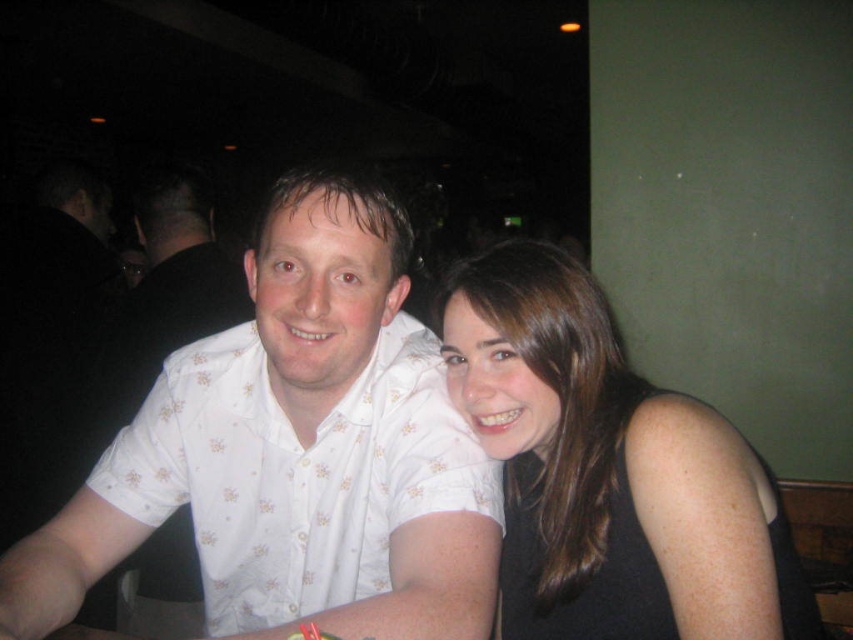
Between white floral shirt at center and white floral shirt at left, which one has less height?

white floral shirt at center

Describe the element at coordinates (294, 452) in the screenshot. I see `white floral shirt at center` at that location.

Does point (242, 504) come in front of point (119, 332)?

That is True.

The image size is (853, 640). In order to click on white floral shirt at center in this screenshot , I will do `click(294, 452)`.

Is black fabric at center to the left of white floral shirt at left from the viewer's perspective?

Incorrect, black fabric at center is not on the left side of white floral shirt at left.

Based on the photo, does black fabric at center appear under white floral shirt at left?

Yes, black fabric at center is below white floral shirt at left.

Between point (669, 540) and point (148, 204), which one is positioned behind?

Point (148, 204)

Image resolution: width=853 pixels, height=640 pixels. Find the location of `black fabric at center`. black fabric at center is located at coordinates (608, 472).

Between white floral shirt at center and black fabric at center, which one appears on the left side from the viewer's perspective?

From the viewer's perspective, white floral shirt at center appears more on the left side.

The width and height of the screenshot is (853, 640). What do you see at coordinates (294, 452) in the screenshot?
I see `white floral shirt at center` at bounding box center [294, 452].

Between point (374, 433) and point (761, 595), which one is positioned behind?

The point (374, 433) is more distant.

Find the location of `white floral shirt at center`. white floral shirt at center is located at coordinates (294, 452).